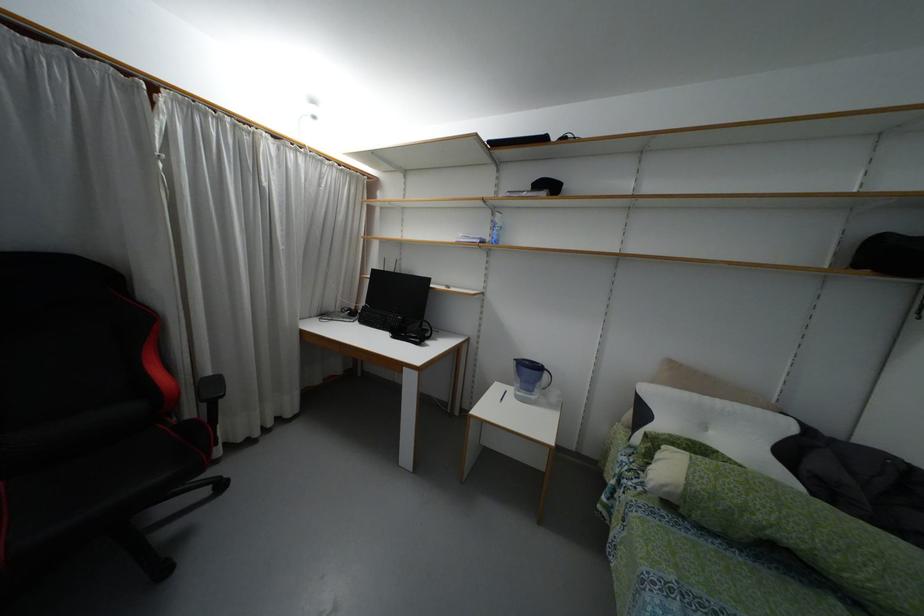
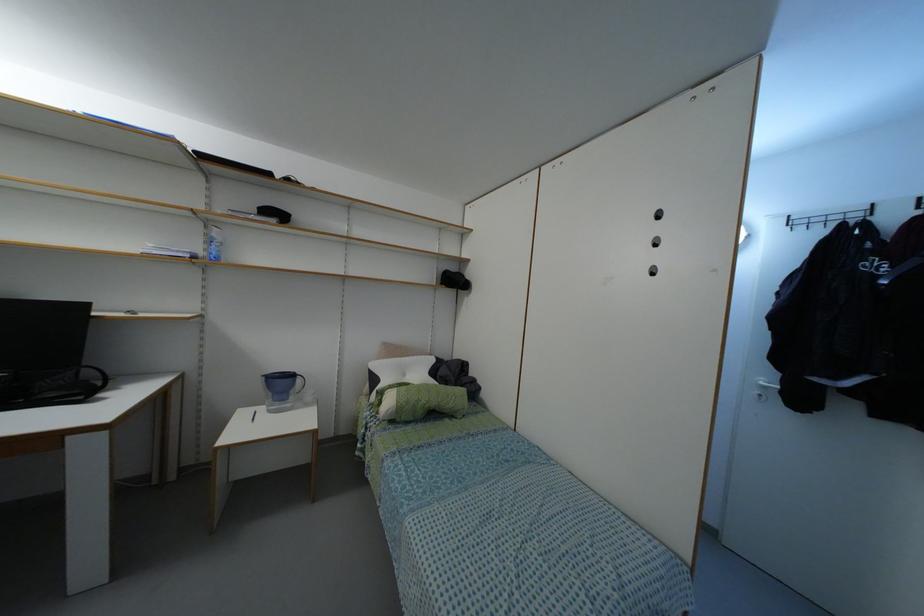
Question: How did the camera likely rotate?

Choices:
 (A) Left
 (B) Right
 (C) Up
 (D) Down

Answer: (B)